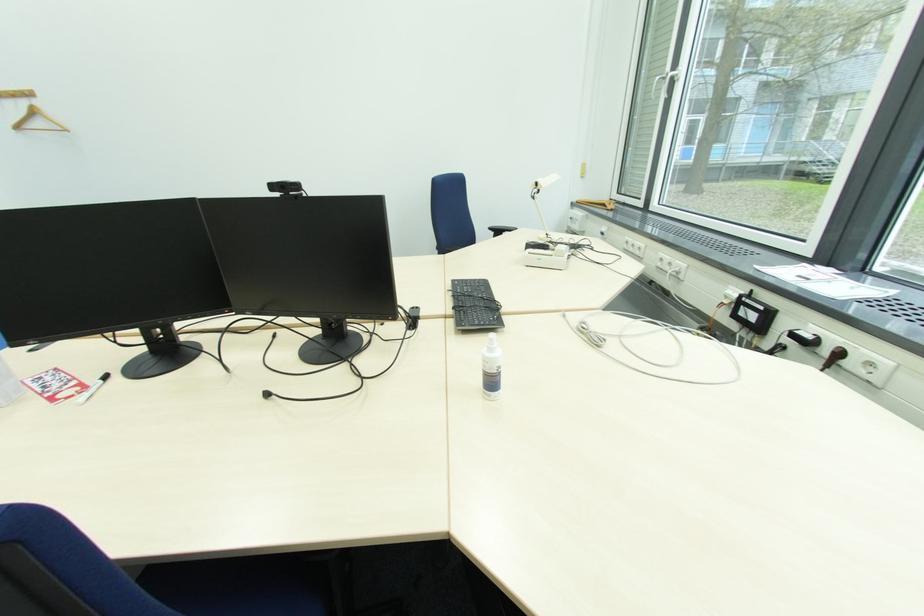
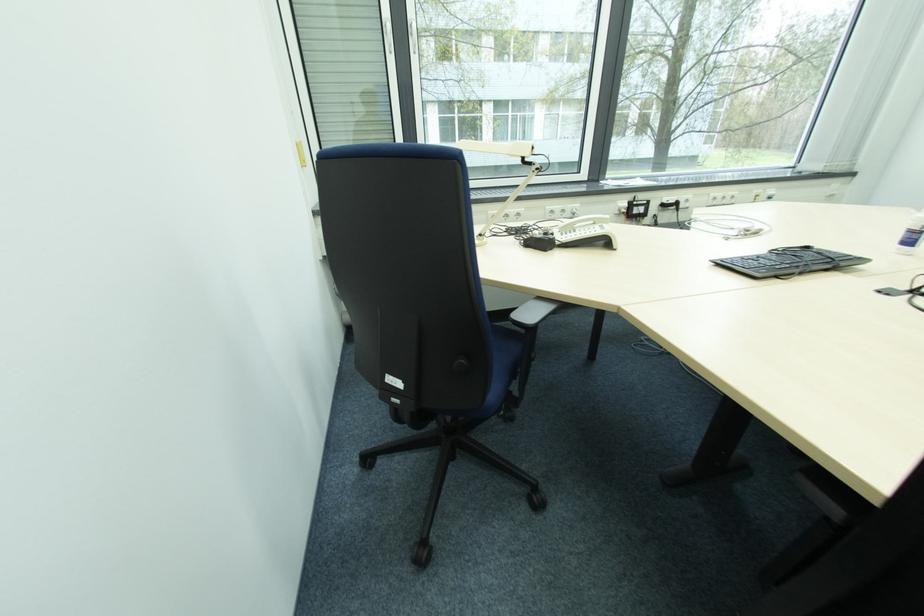
Find the pixel in the second image that matches (541,185) in the first image.

(535, 150)